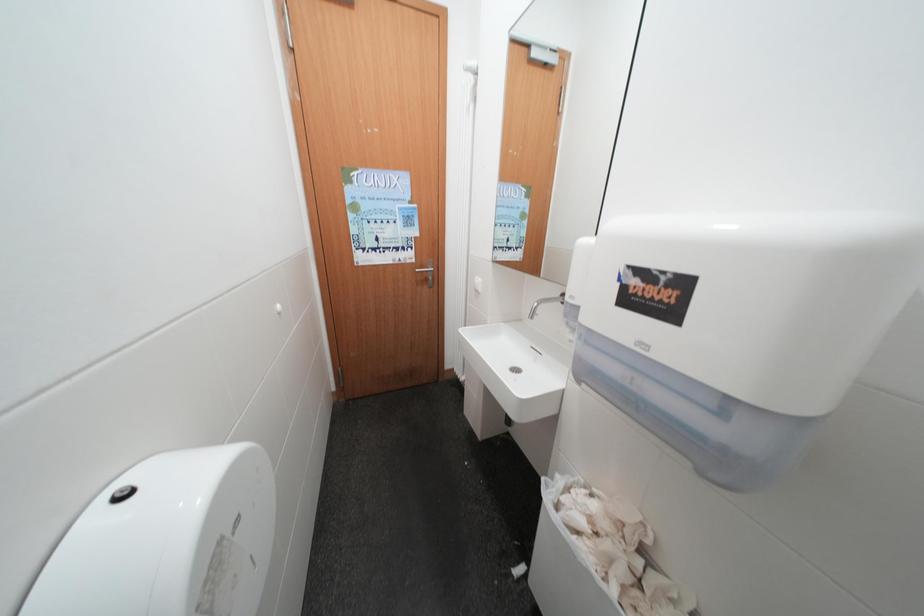
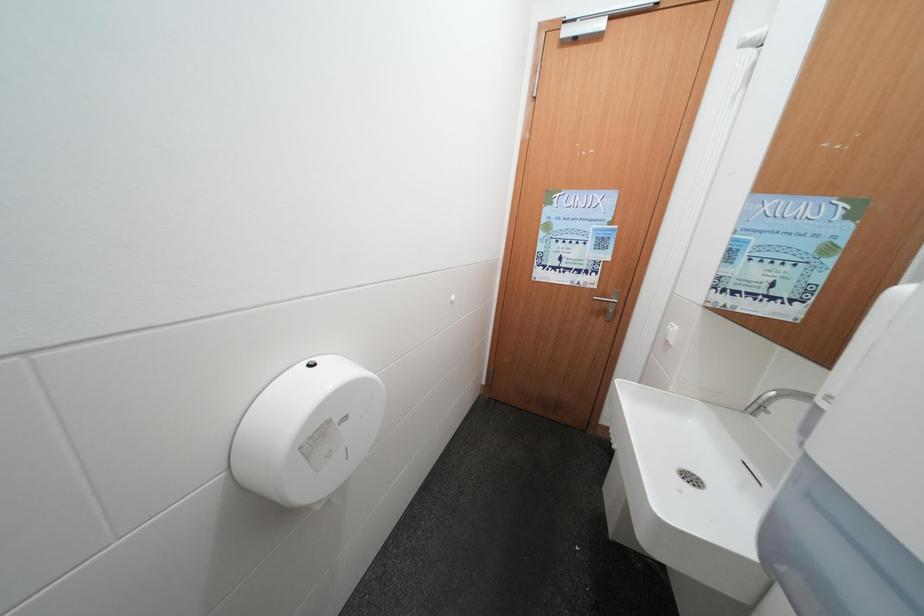
Question: The first image is from the beginning of the video and the second image is from the end. How did the camera likely rotate when shooting the video?

Choices:
 (A) Left
 (B) Right
 (C) Up
 (D) Down

Answer: (A)